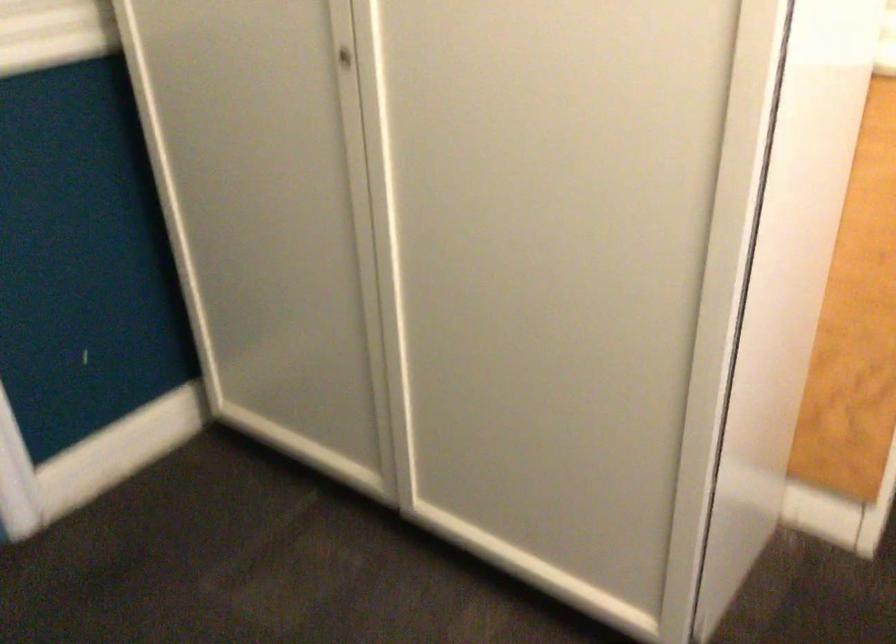
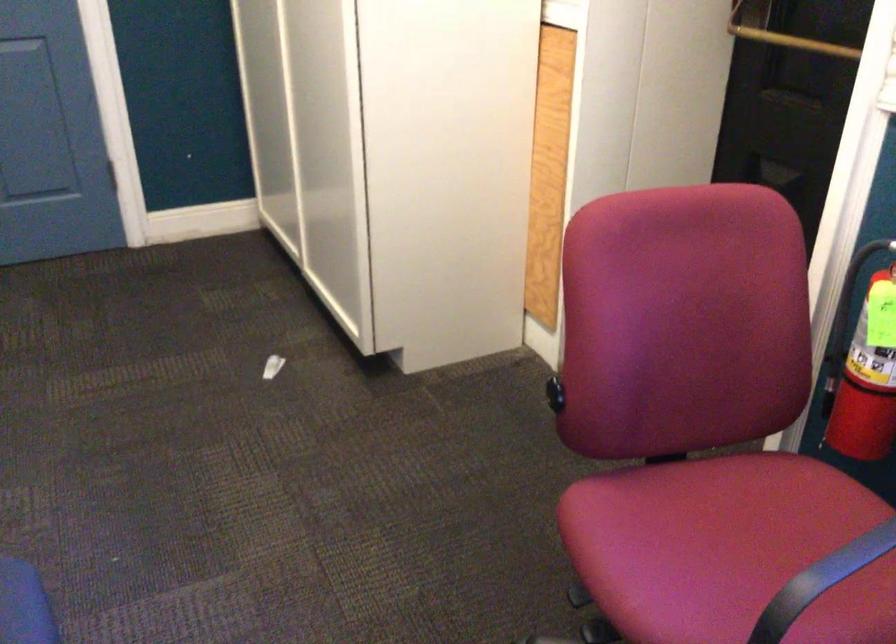
Which direction would the cameraman need to move to produce the second image?

The cameraman walked toward right, backward.